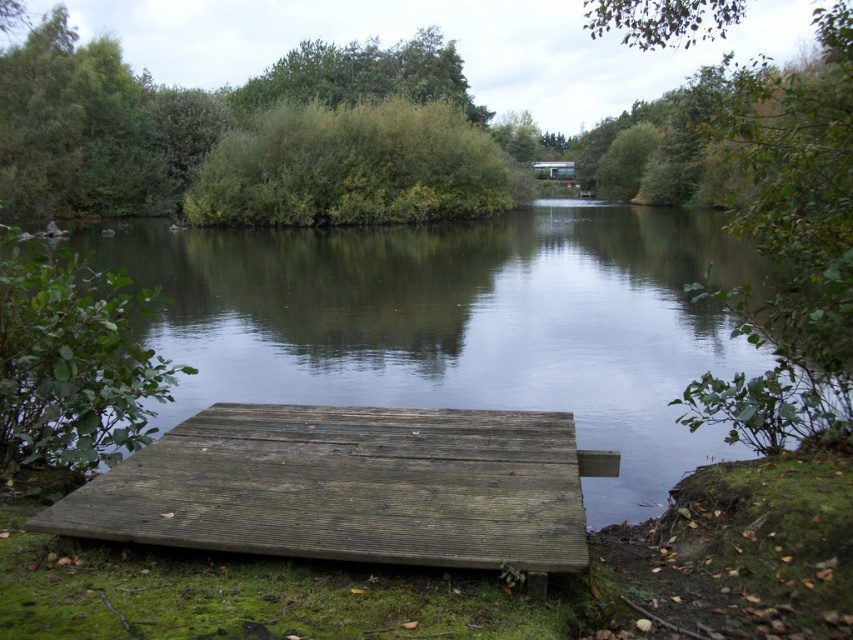
Locate an element on the screen. weathered wood dock at lower center is located at coordinates (351, 486).

Is point (228, 444) positioned before point (364, 45)?

Yes, point (228, 444) is closer to viewer.

Is point (434, 540) closer to camera compared to point (445, 44)?

Yes, point (434, 540) is closer to viewer.

You are a GUI agent. You are given a task and a screenshot of the screen. Output one action in this format:
    pyautogui.click(x=<x>, y=<y>)
    Task: Click on the weathered wood dock at lower center
    The height and width of the screenshot is (640, 853).
    Given the screenshot: What is the action you would take?
    pyautogui.click(x=351, y=486)

Is weathered wood dock at lower center positioned in front of green leafy bush at center?

Yes, it is.

At what (x,y) coordinates should I click in order to perform the action: click on weathered wood dock at lower center. Please return your answer as a coordinate pair (x, y). Looking at the image, I should click on (351, 486).

The height and width of the screenshot is (640, 853). Find the location of `weathered wood dock at lower center`. weathered wood dock at lower center is located at coordinates coord(351,486).

Between greenish-brown wood at center and green leafy bush at center, which one is positioned higher?

Positioned higher is green leafy bush at center.

Between greenish-brown wood at center and green leafy bush at center, which one has more height?

green leafy bush at center is taller.

Is point (431, 262) more distant than point (409, 129)?

No, (431, 262) is in front of (409, 129).

Where is `greenish-brown wood at center`? This screenshot has width=853, height=640. greenish-brown wood at center is located at coordinates (462, 323).